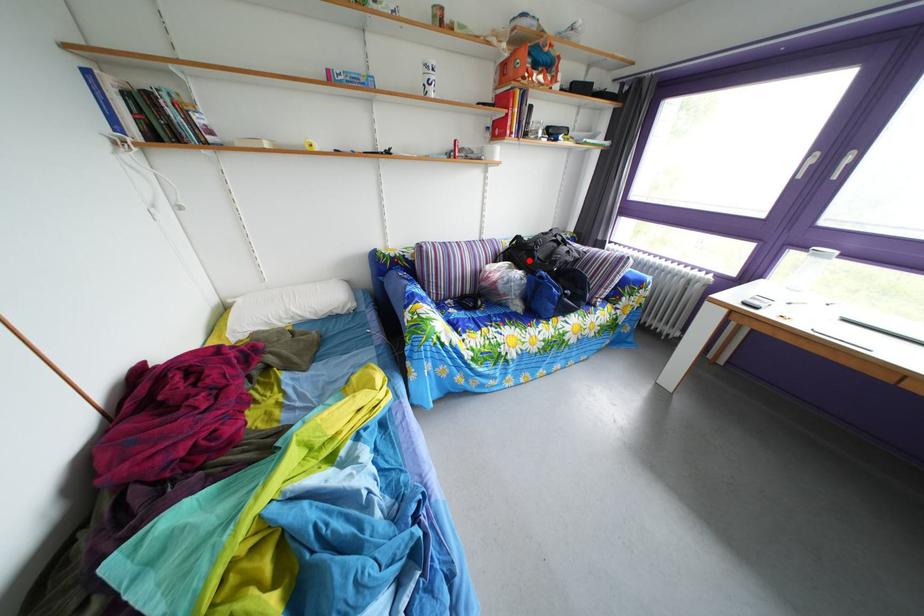
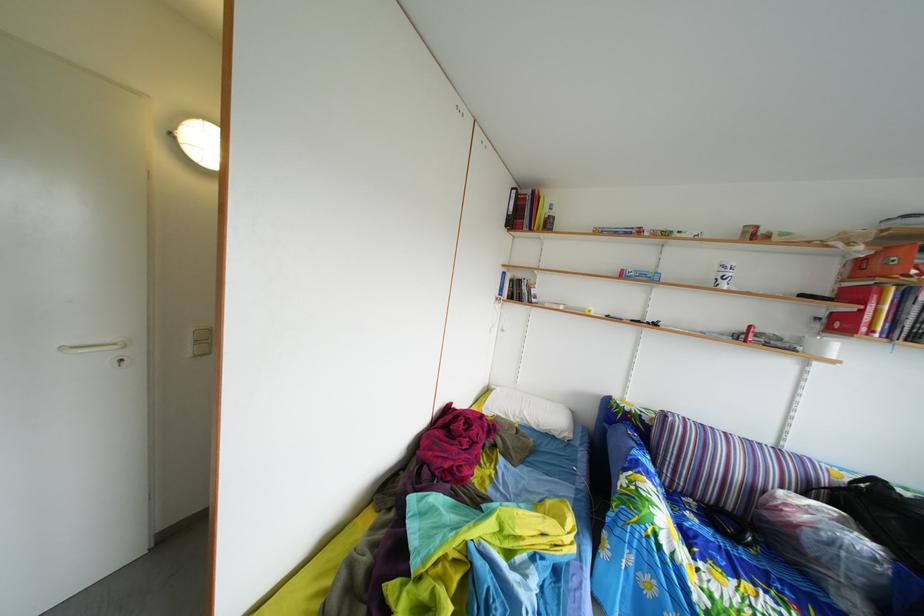
Locate, in the second image, the point that corresponds to the highlighted location in the first image.

(886, 515)